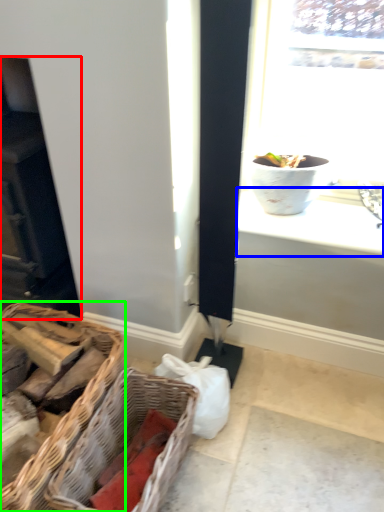
Question: Based on their relative distances, which object is farther from fireplace (highlighted by a red box)? Choose from window sill (highlighted by a blue box) and picnic basket (highlighted by a green box).

Choices:
 (A) window sill
 (B) picnic basket

Answer: (A)